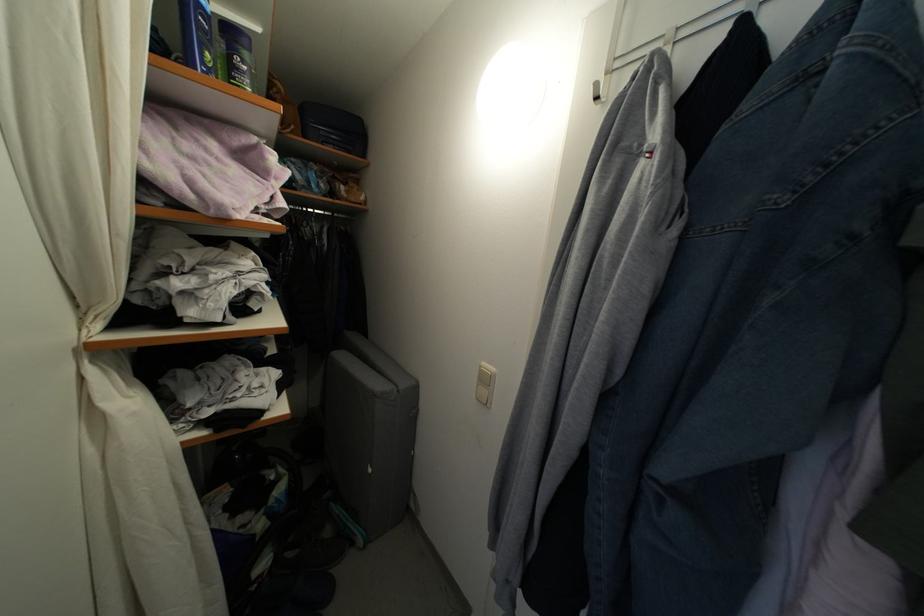
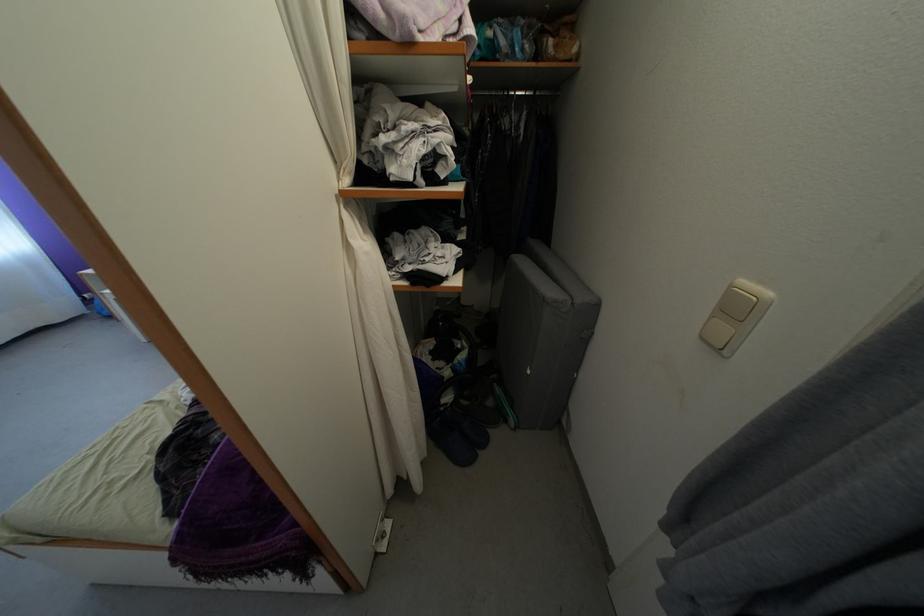
Find the pixel in the second image that matches (x=491, y=386) in the first image.

(743, 315)